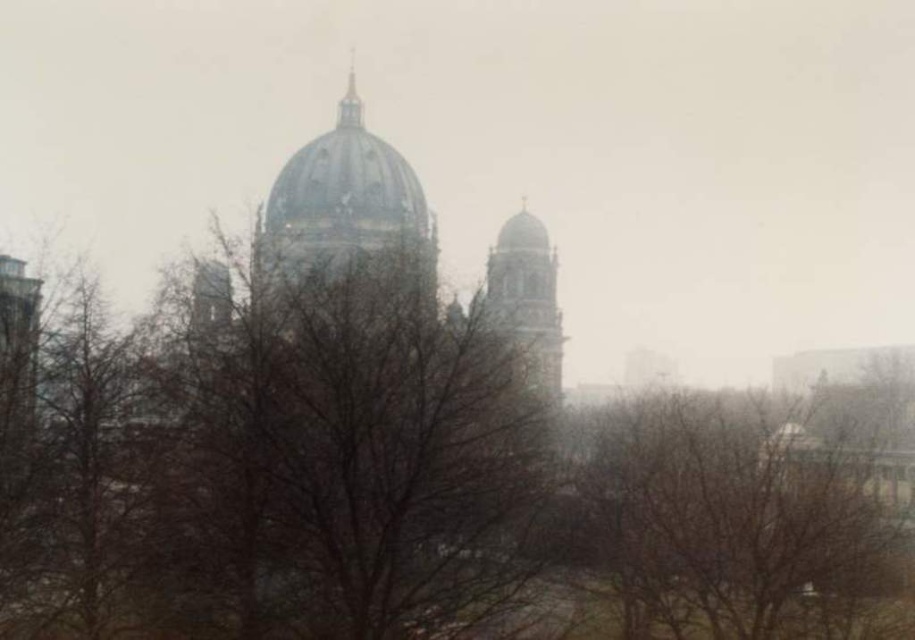
Question: Which point is closer to the camera?

Choices:
 (A) gold domed tower at center
 (B) smooth stone tower at center
 (C) brown leafless branches at center
 (D) brown leafless tree at center

Answer: (C)

Question: Is gold domed tower at center above smooth stone tower at center?

Choices:
 (A) no
 (B) yes

Answer: (B)

Question: Which is nearer to the smooth stone tower at center?

Choices:
 (A) gold metallic spire at upper center
 (B) brown leafless tree at center
 (C) gold domed tower at center
 (D) brown leafless branches at center

Answer: (C)

Question: Which point is closer to the camera taking this photo?

Choices:
 (A) (210, 429)
 (B) (299, 228)

Answer: (A)

Question: Is brown leafless branches at center further to the viewer compared to gold domed tower at center?

Choices:
 (A) no
 (B) yes

Answer: (A)

Question: Is brown leafless branches at center wider than gold metallic spire at upper center?

Choices:
 (A) no
 (B) yes

Answer: (B)